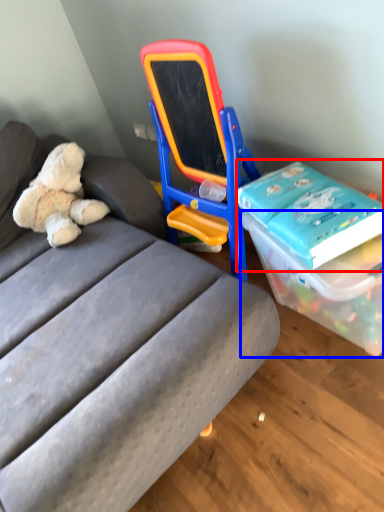
Question: Which object appears farthest to the camera in this image, book (highlighted by a red box) or box (highlighted by a blue box)?

Choices:
 (A) book
 (B) box

Answer: (A)